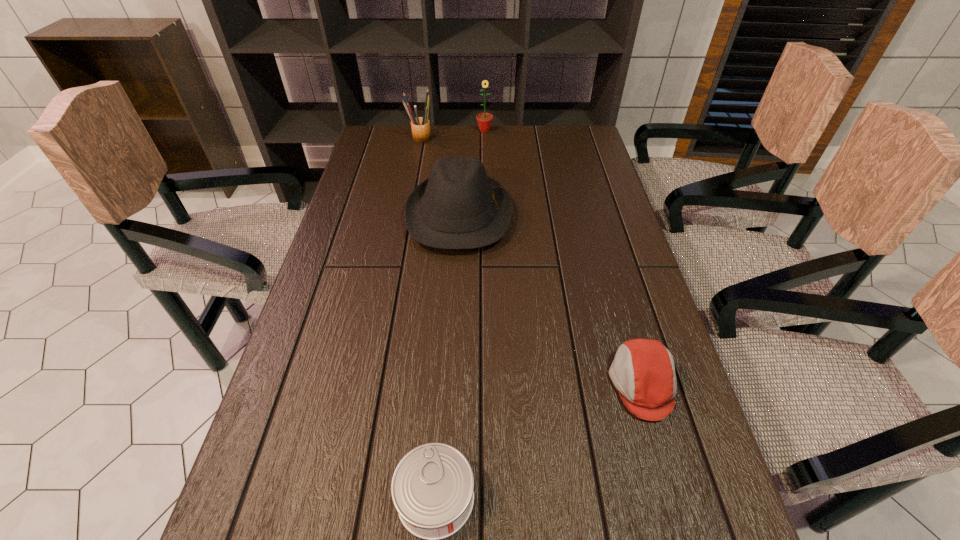
You are a GUI agent. You are given a task and a screenshot of the screen. Output one action in this format:
    pyautogui.click(x=<x>, y=<y>)
    Task: Click on the vacant area that lies between the third farthest object and the cap
    This screenshot has width=960, height=540.
    Given the screenshot: What is the action you would take?
    pyautogui.click(x=550, y=300)

This screenshot has height=540, width=960. In order to click on vacant point located between the cap and the pencil box in this screenshot , I will do `click(531, 261)`.

This screenshot has width=960, height=540. What are the coordinates of `free space between the third farthest object and the rightmost object` in the screenshot? It's located at (550, 300).

Identify which object is located as the fourth nearest to the can. Please provide its 2D coordinates. Your answer should be formatted as a tuple, i.e. [(x, y)], where the tuple contains the x and y coordinates of a point satisfying the conditions above.

[(484, 120)]

Locate which object ranks in proximity to the can. Please provide its 2D coordinates. Your answer should be formatted as a tuple, i.e. [(x, y)], where the tuple contains the x and y coordinates of a point satisfying the conditions above.

[(643, 371)]

What are the coordinates of `vacant space that satisfies the following two spatial constraints: 1. on the face of the sunflower; 2. on the front-facing side of the third farthest object` in the screenshot? It's located at (486, 216).